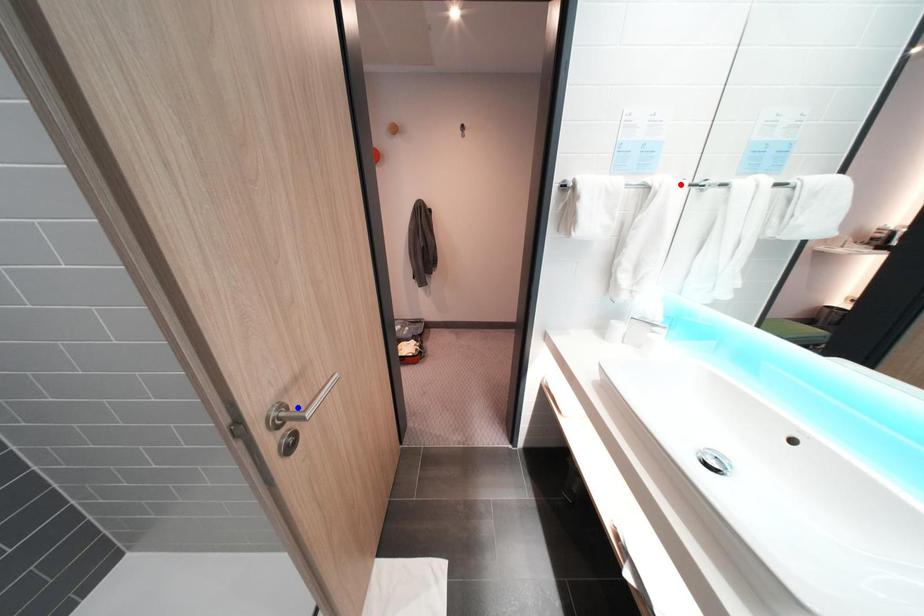
Question: Two points are marked on the image. Which point is closer to the camera?

Choices:
 (A) Blue point is closer.
 (B) Red point is closer.

Answer: (A)